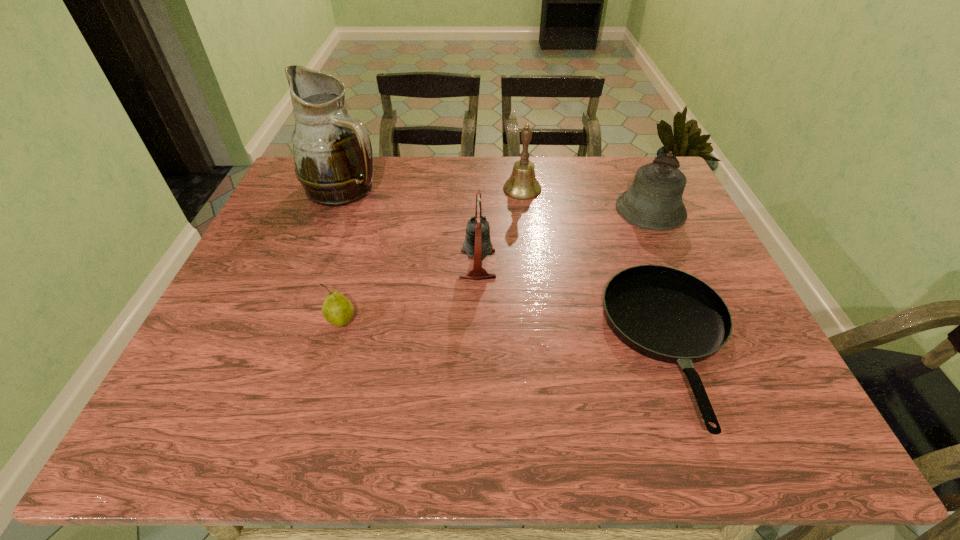
Identify the location of vacant area situated on the front of the rightmost bell. The width and height of the screenshot is (960, 540). (679, 272).

This screenshot has width=960, height=540. I want to click on free space located 0.280m on the right of the pear, so (x=483, y=322).

The image size is (960, 540). Identify the location of pitcher positioned at the far edge. (332, 151).

Image resolution: width=960 pixels, height=540 pixels. I want to click on object that is at the near edge, so click(666, 314).

Find the location of a particular element. This screenshot has height=540, width=960. object that is at the left edge is located at coordinates (332, 151).

In order to click on bell at the right edge in this screenshot , I will do `click(654, 201)`.

This screenshot has height=540, width=960. Identify the location of frying pan situated at the right edge. (666, 314).

Where is `object that is at the far left corner`? The width and height of the screenshot is (960, 540). object that is at the far left corner is located at coordinates (332, 151).

Locate an element on the screen. object that is at the far right corner is located at coordinates tap(654, 201).

At what (x,y) coordinates should I click in order to perform the action: click on object at the near right corner. Please return your answer as a coordinate pair (x, y). This screenshot has width=960, height=540. Looking at the image, I should click on (666, 314).